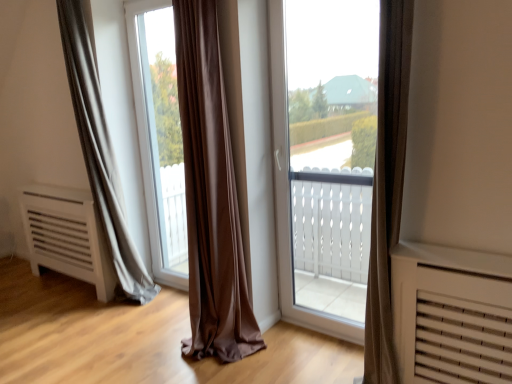
Question: From the image's perspective, is transparent glass window at center located above or below matte gray curtain at left?

Choices:
 (A) above
 (B) below

Answer: (A)

Question: Is transparent glass window at center bigger or smaller than matte gray curtain at left?

Choices:
 (A) big
 (B) small

Answer: (B)

Question: Which of these objects is positioned farthest from the transparent glass window at center?

Choices:
 (A) matte gray curtain at left
 (B) transparent glass window at center

Answer: (B)

Question: Estimate the real-world distances between objects in this image. Which object is closer to the transparent glass window at center?

Choices:
 (A) matte gray curtain at left
 (B) transparent glass window at center

Answer: (A)